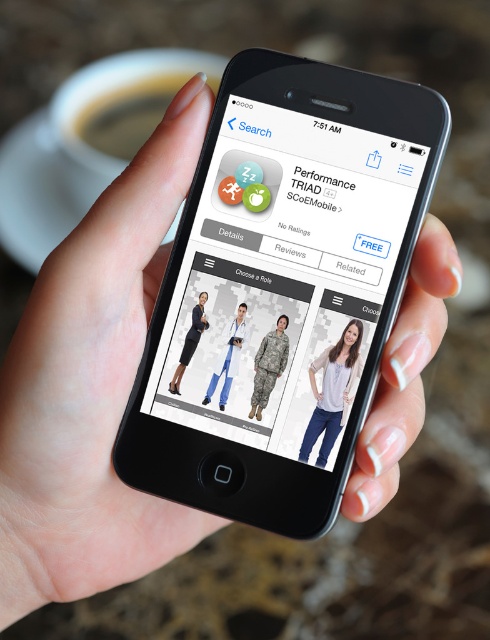
Can you confirm if brown liquid at upper left is positioned to the right of matte white coat at center?

In fact, brown liquid at upper left is to the left of matte white coat at center.

Find the location of a particular element. Image resolution: width=490 pixels, height=640 pixels. brown liquid at upper left is located at coordinates (126, 115).

Between point (156, 104) and point (229, 364), which one is positioned behind?

Positioned behind is point (156, 104).

At what (x,y) coordinates should I click in order to perform the action: click on brown liquid at upper left. Please return your answer as a coordinate pair (x, y). Looking at the image, I should click on (126, 115).

Which is more to the right, camouflage fabric uniform at center or matte black dress at center?

camouflage fabric uniform at center

Measure the distance from camouflage fabric uniform at center to matte black dress at center.

A distance of 1.69 inches exists between camouflage fabric uniform at center and matte black dress at center.

Does point (274, 330) come farther from viewer compared to point (181, 372)?

No, (274, 330) is closer to viewer.

At what (x,y) coordinates should I click in order to perform the action: click on camouflage fabric uniform at center. Please return your answer as a coordinate pair (x, y). Looking at the image, I should click on (269, 365).

Can you confirm if brown liquid at upper left is smaller than matte black dress at center?

Incorrect, brown liquid at upper left is not smaller in size than matte black dress at center.

Between brown liquid at upper left and matte black dress at center, which one has more height?

brown liquid at upper left is taller.

Between point (135, 145) and point (198, 310), which one is positioned in front?

Point (198, 310)

Where is `brown liquid at upper left`? brown liquid at upper left is located at coordinates (126, 115).